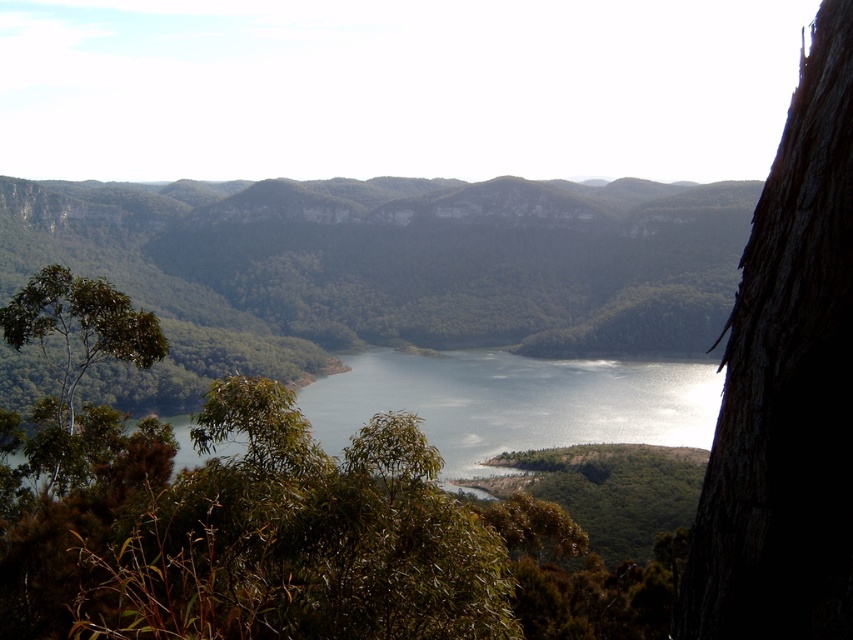
Question: Does green leafy forest at center have a larger size compared to brown rough bark tree at right?

Choices:
 (A) yes
 (B) no

Answer: (A)

Question: Which of the following is the farthest from the observer?

Choices:
 (A) green leafy tree at left
 (B) brown rough bark tree at right
 (C) green leafy forest at center

Answer: (C)

Question: Does green leafy forest at center have a greater width compared to brown rough bark tree at right?

Choices:
 (A) yes
 (B) no

Answer: (A)

Question: Is green leafy forest at center below brown rough bark tree at right?

Choices:
 (A) no
 (B) yes

Answer: (A)

Question: Which point appears closest to the camera in this image?

Choices:
 (A) (137, 360)
 (B) (241, 230)

Answer: (A)

Question: Which of the following is the farthest from the observer?

Choices:
 (A) green leafy forest at center
 (B) brown rough bark tree at right
 (C) green leafy tree at left

Answer: (A)